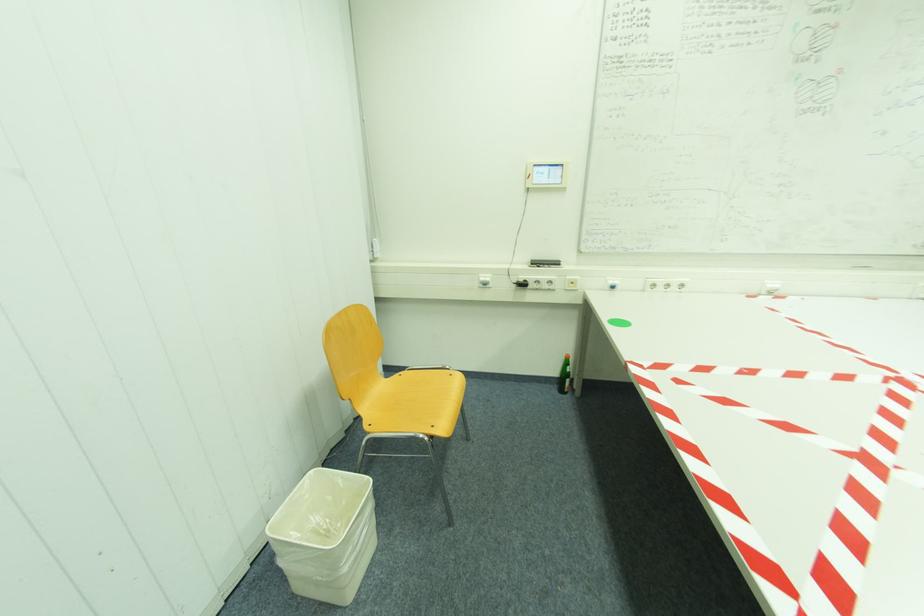
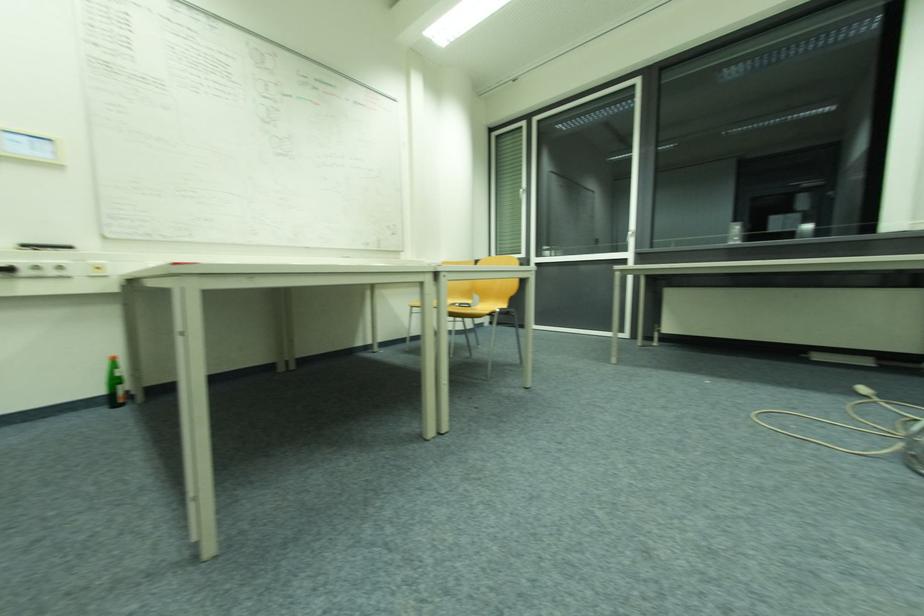
Question: The camera is either moving clockwise (left) or counter-clockwise (right) around the object. The first image is from the beginning of the video and the second image is from the end. Is the camera moving left or right when shooting the video?

Choices:
 (A) Left
 (B) Right

Answer: (A)